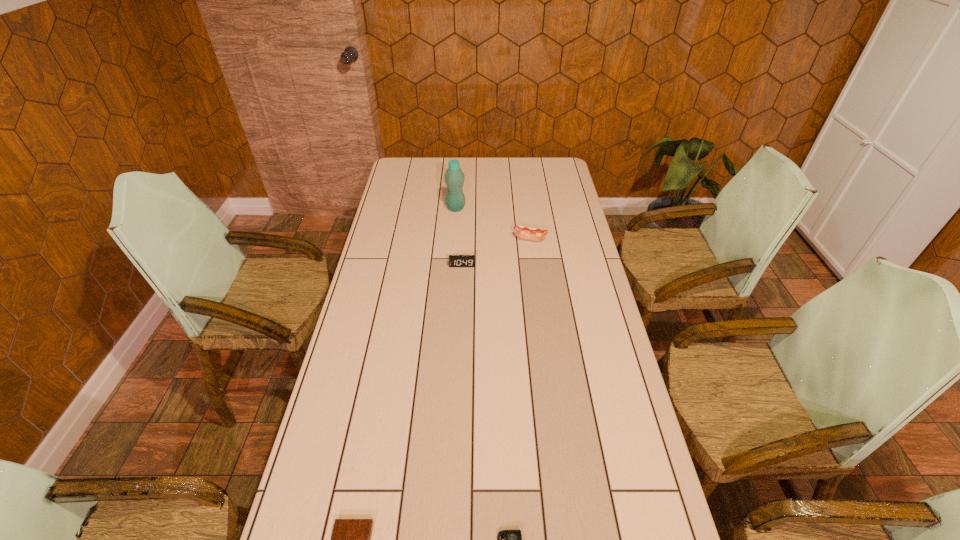
In order to click on alarm clock identified as the second closest to the rightmost alarm clock in this screenshot , I will do `click(454, 260)`.

The width and height of the screenshot is (960, 540). Find the location of `alarm clock that can be found as the closest to the water bottle`. alarm clock that can be found as the closest to the water bottle is located at coordinates (454, 260).

This screenshot has height=540, width=960. What are the coordinates of `vacant area in the image that satisfies the following two spatial constraints: 1. at the front cap of the second farthest object; 2. on the left side of the tallest object` in the screenshot? It's located at (454, 239).

Find the location of `vacant space that satisfies the following two spatial constraints: 1. at the front cap of the tallest object; 2. on the left side of the rightmost object`. vacant space that satisfies the following two spatial constraints: 1. at the front cap of the tallest object; 2. on the left side of the rightmost object is located at coordinates (454, 239).